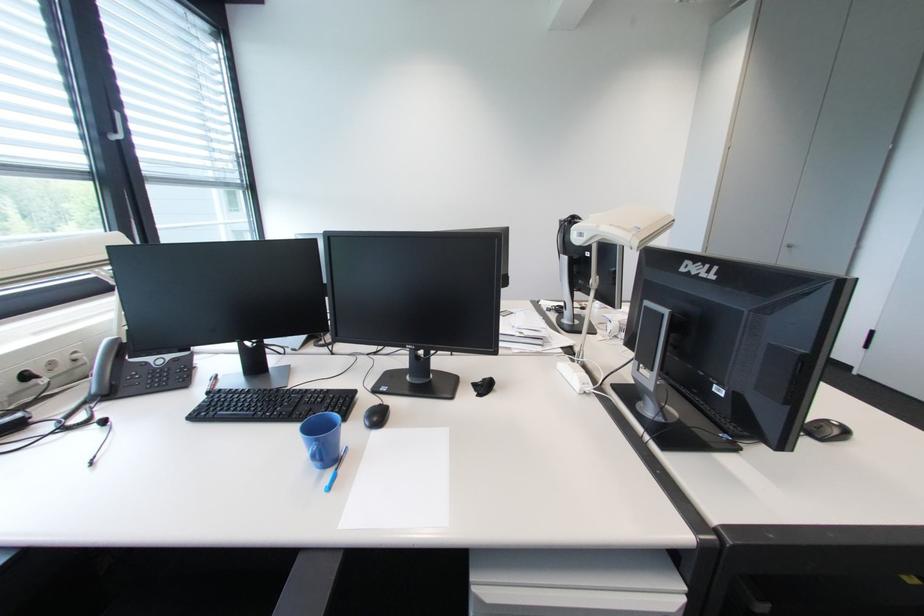
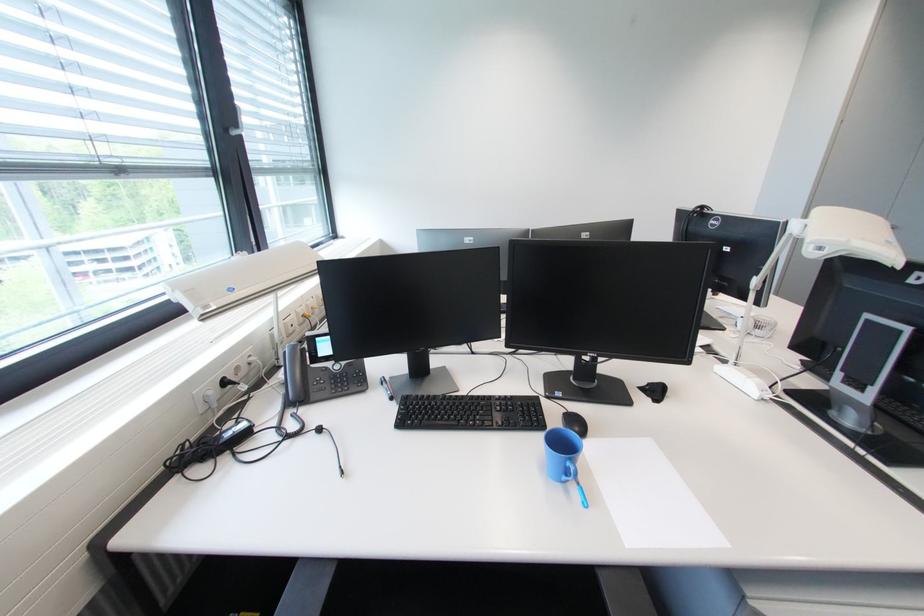
In the second image, find the point that corresponds to (x=604, y=227) in the first image.

(856, 243)